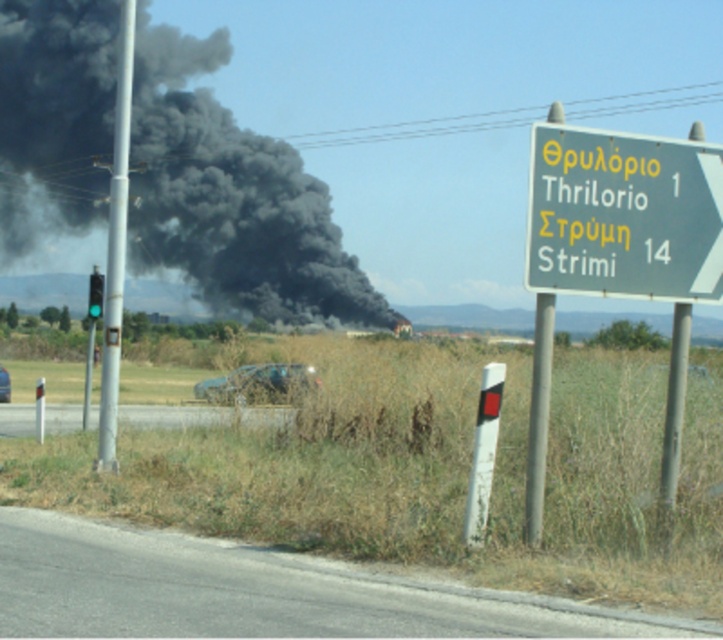
Question: Which is farther from the gray asphalt road at lower center?

Choices:
 (A) green glass traffic light at left
 (B) blue matte car at center
 (C) black smoke at left
 (D) green plastic sign at upper right

Answer: (C)

Question: Which point is closer to the camera?

Choices:
 (A) (4, 371)
 (B) (301, 385)

Answer: (B)

Question: Does green plastic sign at upper right appear over green glass traffic light at left?

Choices:
 (A) no
 (B) yes

Answer: (B)

Question: Is gray asphalt road at lower center positioned behind metallic blue car at center?

Choices:
 (A) no
 (B) yes

Answer: (B)

Question: Which point appears farthest from the camera in this image?

Choices:
 (A) (59, 65)
 (B) (100, 276)

Answer: (A)

Question: Is green metallic sign at upper right above metallic blue car at center?

Choices:
 (A) no
 (B) yes

Answer: (B)